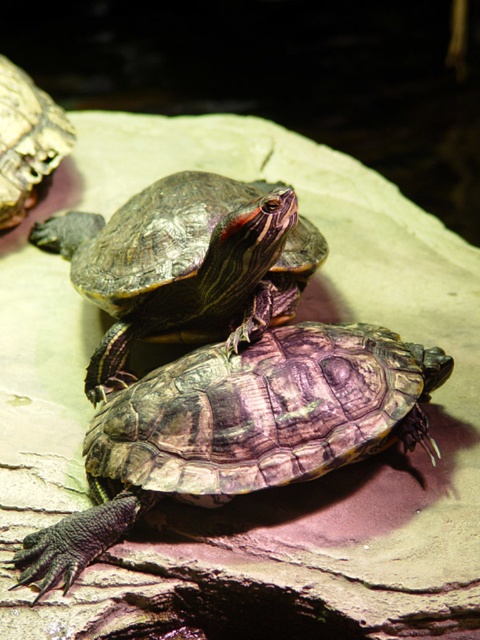
Is shiny brown tortoise at center further to camera compared to shiny brown tortoise at upper left?

No, shiny brown tortoise at center is in front of shiny brown tortoise at upper left.

Is point (115, 360) positioned behind point (24, 116)?

No, (115, 360) is in front of (24, 116).

The width and height of the screenshot is (480, 640). I want to click on shiny brown tortoise at center, so [199, 282].

Does textured brown tortoise at center have a lesser height compared to shiny brown tortoise at center?

Indeed, textured brown tortoise at center has a lesser height compared to shiny brown tortoise at center.

Which of these two, textured brown tortoise at center or shiny brown tortoise at center, stands shorter?

textured brown tortoise at center

Who is more distant from viewer, (158,472) or (59,250)?

Positioned behind is point (59,250).

Where is `textured brown tortoise at center`? textured brown tortoise at center is located at coordinates (240, 428).

Does textured brown tortoise at center have a lesser width compared to shiny brown tortoise at upper left?

Incorrect, textured brown tortoise at center's width is not less than shiny brown tortoise at upper left's.

Which of these two, textured brown tortoise at center or shiny brown tortoise at upper left, stands shorter?

With less height is textured brown tortoise at center.

Is point (348, 387) closer to camera compared to point (0, 138)?

Yes.

Locate an element on the screen. textured brown tortoise at center is located at coordinates (240, 428).